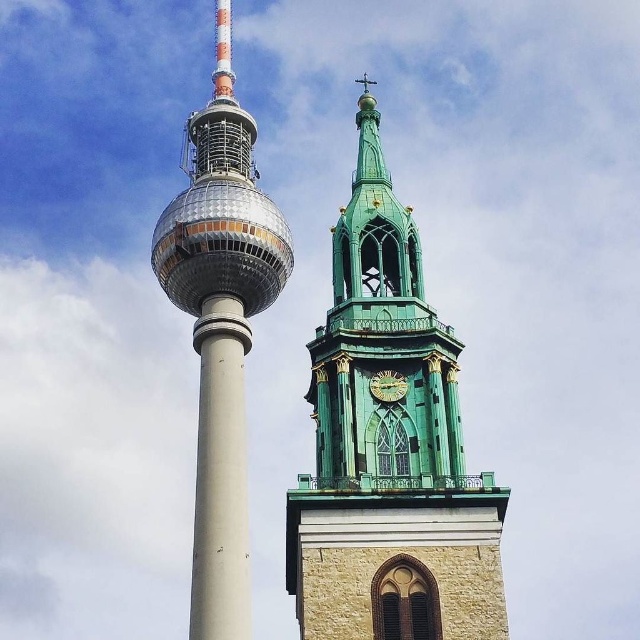
Question: Estimate the real-world distances between objects in this image. Which object is farther from the green stone clock tower at upper right?

Choices:
 (A) green stone clock at center
 (B) shiny metallic tower at left

Answer: (B)

Question: Which point is closer to the camera taking this photo?

Choices:
 (A) (344, 211)
 (B) (225, 241)
 (C) (384, 392)
 (D) (218, 499)

Answer: (D)

Question: Is the position of green stone clock tower at upper right more distant than that of green stone clock at center?

Choices:
 (A) no
 (B) yes

Answer: (A)

Question: Among these objects, which one is farthest from the camera?

Choices:
 (A) white concrete pillar at center
 (B) green stone clock at center
 (C) shiny metallic tower at left

Answer: (B)

Question: Does white concrete pillar at center have a greater width compared to green stone clock at center?

Choices:
 (A) yes
 (B) no

Answer: (A)

Question: Is green stone clock tower at upper right below shiny metallic tower at left?

Choices:
 (A) yes
 (B) no

Answer: (B)